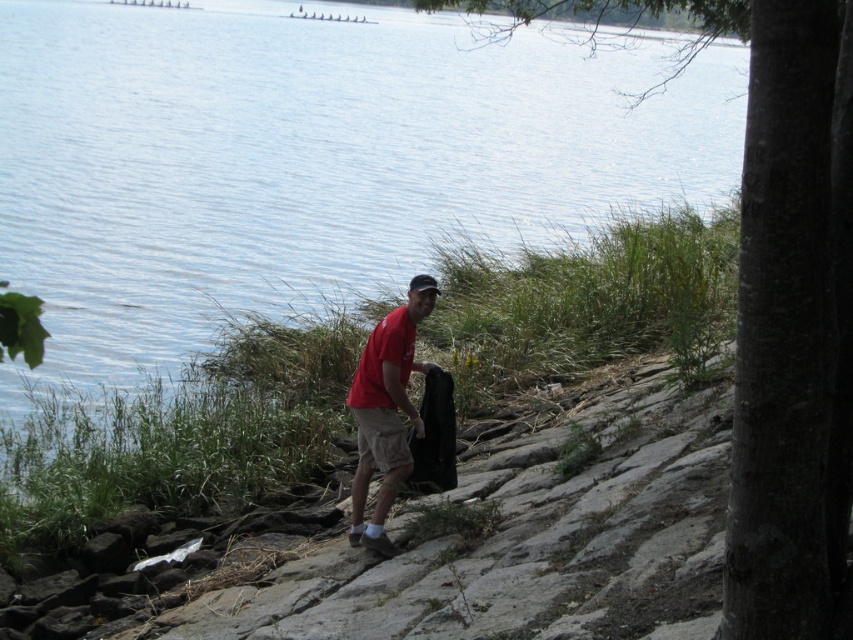
Question: Does blue water at center lie in front of matte red t-shirt at center?

Choices:
 (A) no
 (B) yes

Answer: (B)

Question: Does blue water at center come behind matte red t-shirt at center?

Choices:
 (A) no
 (B) yes

Answer: (A)

Question: Which object appears closest to the camera in this image?

Choices:
 (A) matte red t-shirt at center
 (B) blue water at center

Answer: (B)

Question: Which object appears closest to the camera in this image?

Choices:
 (A) blue water at center
 (B) matte red t-shirt at center

Answer: (A)

Question: Does blue water at center have a greater width compared to matte red t-shirt at center?

Choices:
 (A) no
 (B) yes

Answer: (B)